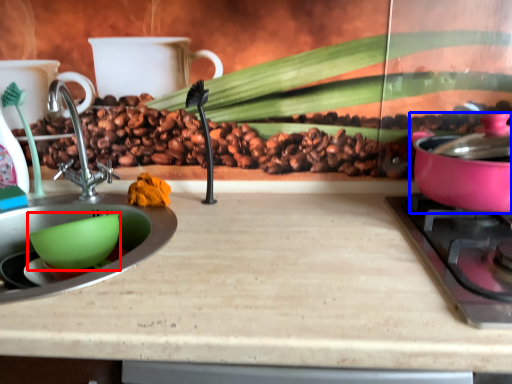
Question: Which object appears farthest to the camera in this image, mixing bowl (highlighted by a red box) or kitchen appliance (highlighted by a blue box)?

Choices:
 (A) mixing bowl
 (B) kitchen appliance

Answer: (A)